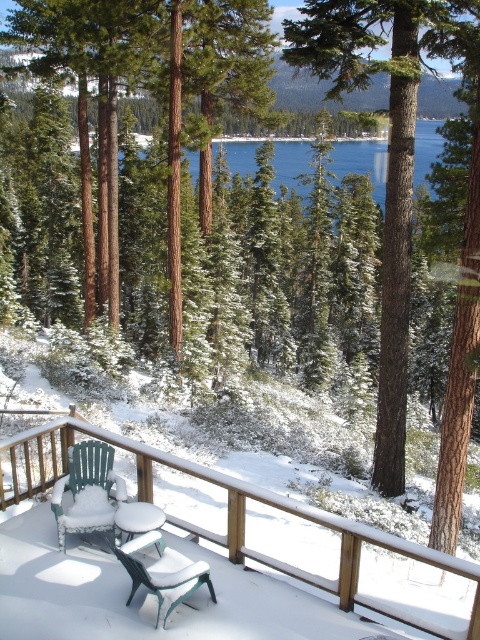
Consider the image. Does brown textured tree at center appear on the left side of green plastic chair at lower center?

No, brown textured tree at center is not to the left of green plastic chair at lower center.

Does brown textured tree at center have a lesser height compared to green plastic chair at lower center?

No.

Is point (382, 323) more distant than point (165, 595)?

Yes, it is behind point (165, 595).

Identify the location of brown textured tree at center. (387, 156).

Based on the photo, is green plastic chairs at lower left to the right of green plastic chair at lower left from the viewer's perspective?

No, green plastic chairs at lower left is not to the right of green plastic chair at lower left.

Is point (339, 564) closer to camera compared to point (108, 524)?

Yes, point (339, 564) is in front of point (108, 524).

Where is `green plastic chairs at lower left`? Image resolution: width=480 pixels, height=640 pixels. green plastic chairs at lower left is located at coordinates (232, 516).

Is brown textured tree at center positioned in front of green plastic chair at lower left?

No, it is behind green plastic chair at lower left.

From the picture: Which is more to the right, brown textured tree at center or green plastic chair at lower left?

Positioned to the right is brown textured tree at center.

You are a GUI agent. You are given a task and a screenshot of the screen. Output one action in this format:
    pyautogui.click(x=<x>, y=<y>)
    Task: Click on the brown textured tree at center
    Image resolution: width=480 pixels, height=640 pixels.
    Given the screenshot: What is the action you would take?
    pyautogui.click(x=387, y=156)